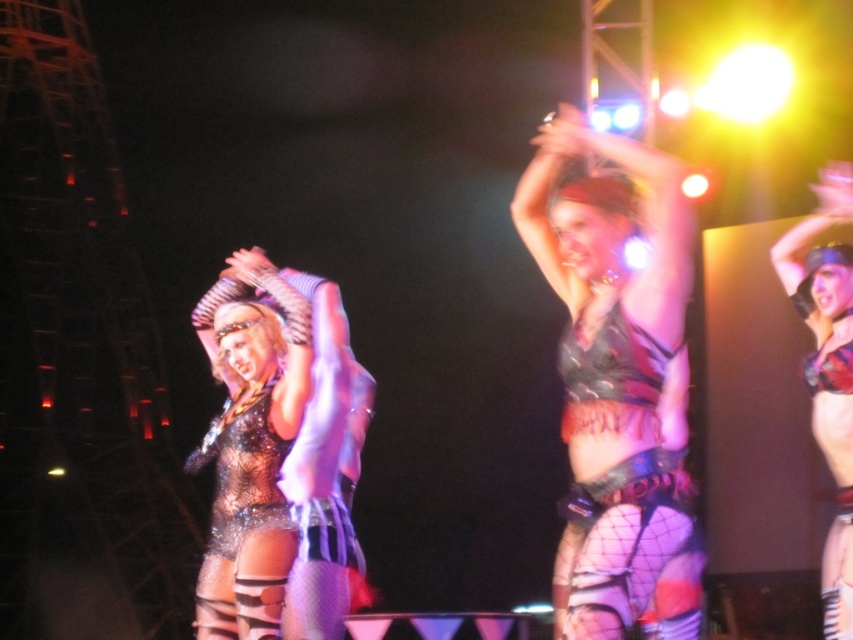
Does glittery sequined outfit at center have a greater height compared to shiny red bikini at upper right?

Incorrect, glittery sequined outfit at center's height is not larger of shiny red bikini at upper right's.

Which of these two, glittery sequined outfit at center or shiny red bikini at upper right, stands taller?

With more height is shiny red bikini at upper right.

Who is more distant from viewer, (273, 593) or (850, 324)?

The point (850, 324) is more distant.

The width and height of the screenshot is (853, 640). Find the location of `glittery sequined outfit at center`. glittery sequined outfit at center is located at coordinates (250, 445).

From the picture: Can you confirm if glittery sequined outfit at center is positioned below glittery mesh bodysuit at center?

Incorrect, glittery sequined outfit at center is not positioned below glittery mesh bodysuit at center.

Can you confirm if glittery sequined outfit at center is wider than glittery mesh bodysuit at center?

Correct, the width of glittery sequined outfit at center exceeds that of glittery mesh bodysuit at center.

Between point (221, 449) and point (264, 454), which one is positioned in front?

Point (264, 454) is more forward.

The width and height of the screenshot is (853, 640). What are the coordinates of `glittery sequined outfit at center` in the screenshot? It's located at (250, 445).

Between glittery sequined outfit at center and shiny metallic bikini at upper right, which one is positioned higher?

glittery sequined outfit at center is above.

Identify the location of glittery sequined outfit at center. This screenshot has height=640, width=853. (250, 445).